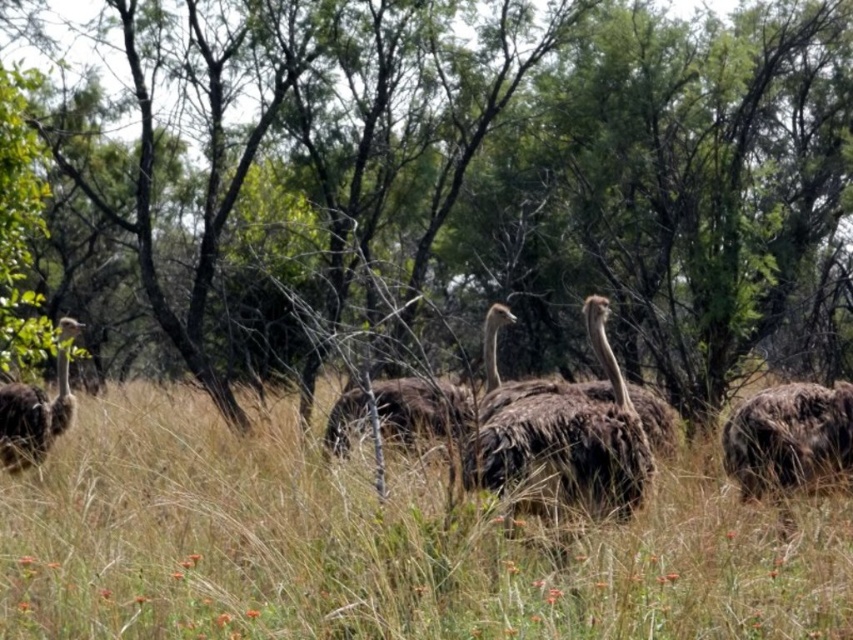
You are a wildlife photographer standing at the edge of the savanna. You want to capture a photo of the brown fuzzy ostrich at center and the dark brown feathers at left in the same frame. Given that your camera has a 50mm lens, which has a field of view of approximately 46 degrees, can you estimate if both subjects will fit in the frame?

The distance between the brown fuzzy ostrich at center and the dark brown feathers at left is 15.06 feet. Using the camera lens formula, the field of view at 50mm is about 46 degrees. To determine if both subjects fit, we can calculate the maximum distance that can be captured within the 46 degree angle. Assuming the photographer is positioned equidistant from both subjects, the 15.06 feet separation might be within the 46 degree field of view, but precise calculation would require knowing the exact camera

You are an ornithologist studying the ostriches in this image. You notice two points marked in the scene. Which point is closer to you, point [300,3] or point [573,456]?

Point [300,3] is closer to you than point [573,456].

You are an ornithologist studying the ostriches in this savanna scene. You notice a point marked at coordinates (451, 180). Which object in the scene does this point correspond to?

The point at coordinates (451, 180) corresponds to the green leafy tree at center.